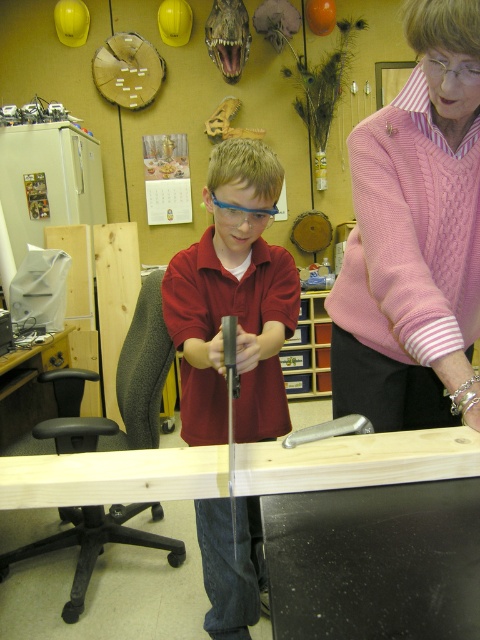
Who is shorter, matte plastic glasses at center or black plastic workbench at lower center?

With less height is black plastic workbench at lower center.

In the scene shown: Is matte plastic glasses at center bigger than black plastic workbench at lower center?

Correct, matte plastic glasses at center is larger in size than black plastic workbench at lower center.

Who is more distant from viewer, (252, 355) or (6, 408)?

The point (6, 408) is more distant.

The width and height of the screenshot is (480, 640). In order to click on matte plastic glasses at center in this screenshot , I will do `click(233, 300)`.

What do you see at coordinates (415, 237) in the screenshot?
I see `pink knitted sweater at upper right` at bounding box center [415, 237].

Who is taller, pink knitted sweater at upper right or matte plastic glasses at center?

matte plastic glasses at center is taller.

Identify the location of pink knitted sweater at upper right. (415, 237).

You are a GUI agent. You are given a task and a screenshot of the screen. Output one action in this format:
    pyautogui.click(x=<x>, y=<y>)
    Task: Click on the pink knitted sweater at upper right
    
    Given the screenshot: What is the action you would take?
    pyautogui.click(x=415, y=237)

Who is more distant from viewer, (355, 182) or (22, 369)?

Positioned behind is point (22, 369).

Does point (466, 417) lie behind point (23, 396)?

No, it is not.

Is point (405, 237) farther from viewer compared to point (23, 372)?

That is False.

Where is `pink knitted sweater at upper right`? The width and height of the screenshot is (480, 640). pink knitted sweater at upper right is located at coordinates (415, 237).